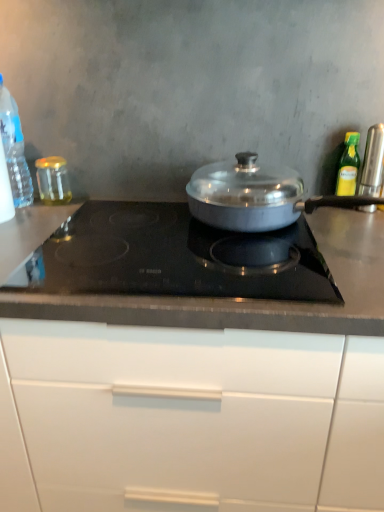
The image size is (384, 512). In order to click on vacant space in front of translucent glass jar at left, placed as the 4th kitchen appliance when sorted from right to left in this screenshot , I will do `click(39, 217)`.